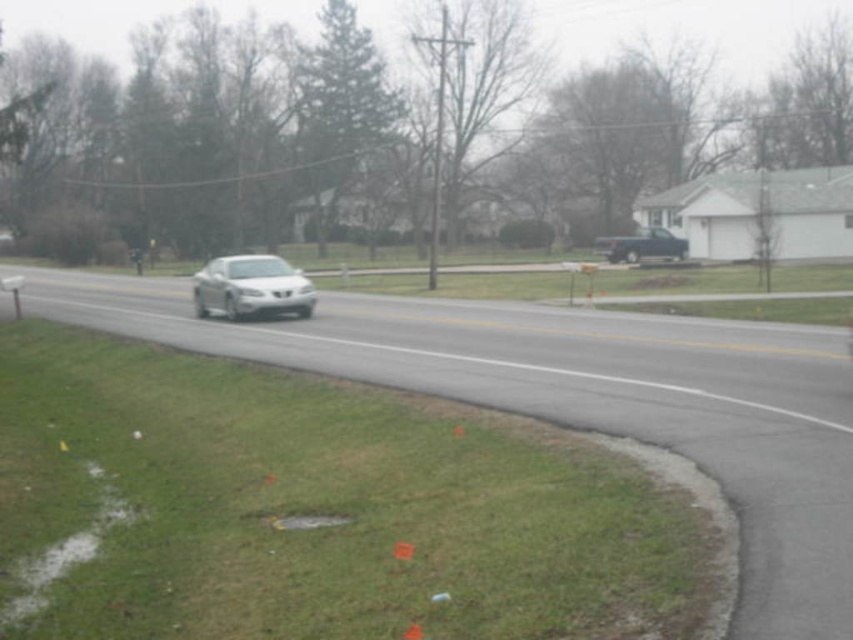
You need to park a car that is 1.8 meters wide in this suburban street scene. The satin silver sedan at center is currently occupying the road. Can the metallic blue truck at right fit in the space between the sedan and the curb on the right side?

The satin silver sedan at center is wider than the metallic blue truck at right. Since the sedan is taking up more space, there might not be enough room for the truck between the sedan and the curb. However, without knowing the exact width of the road, it is difficult to determine if the space is sufficient.

You are standing at point A located at coordinates point A at (x=251, y=284). You need to walk to point B, which is 24.94 meters away. Considering the suburban street scene described, is there a clear path between these two points without obstacles?

Yes, there is a clear path between point A at (x=251, y=284) and point B since the suburban street scene has an asphalt road with a yellow dividing line and no mentioned obstacles between them. The distance of 24.94 meters can be traversed safely.

You are a delivery driver who needs to pass through the area shown in the image. Your delivery van is 20 feet long. There is a satin silver sedan at center and a metallic blue truck at right. Can you safely maneuver your van between them without hitting either vehicle?

The satin silver sedan at center and metallic blue truck at right are 86.01 feet apart from each other. Since your delivery van is only 20 feet long, there is sufficient space between them to safely maneuver without collision.